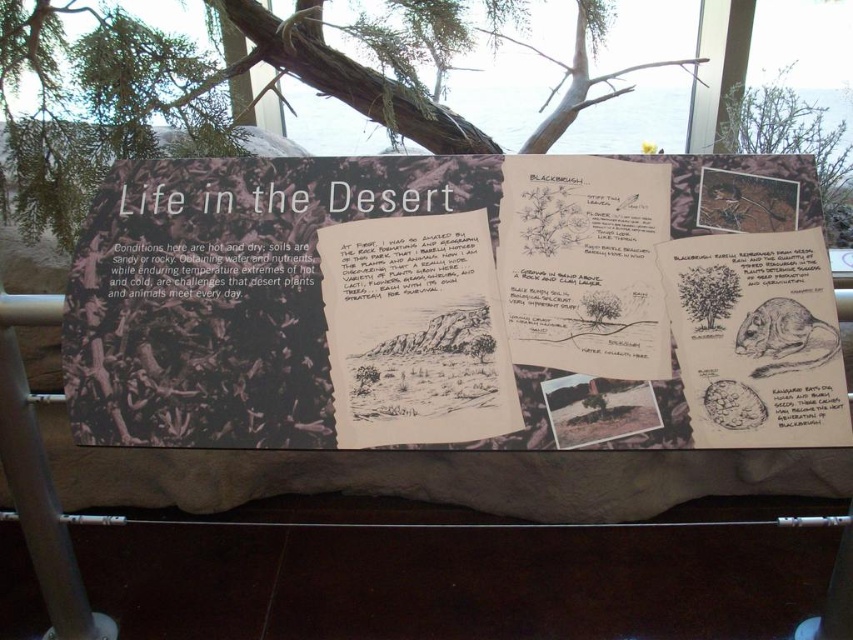
Can you confirm if brown paper sketch at center right is positioned below black paper at lower right?

No, brown paper sketch at center right is not below black paper at lower right.

Between point (692, 381) and point (833, 387), which one is positioned in front?

Positioned in front is point (833, 387).

Does point (809, 435) lie behind point (827, 390)?

No, (809, 435) is closer to viewer.

Identify the location of brown paper sketch at center right. (756, 339).

Does black ink drawing of plant at center appear on the left side of brown paper sketch at center right?

Yes, black ink drawing of plant at center is to the left of brown paper sketch at center right.

Who is more distant from viewer, (x=613, y=346) or (x=737, y=260)?

The point (x=737, y=260) is more distant.

Which is in front, point (592, 314) or point (721, 400)?

Point (721, 400) is more forward.

Where is `black ink drawing of plant at center`? The height and width of the screenshot is (640, 853). black ink drawing of plant at center is located at coordinates (584, 264).

Which of these two, brown paper sketch at center right or black paper text at center, stands taller?

Standing taller between the two is brown paper sketch at center right.

Is brown paper sketch at center right positioned at the back of black paper text at center?

No.

Consider the image. Who is more forward, (708, 262) or (265, 285)?

Positioned in front is point (708, 262).

The image size is (853, 640). Identify the location of brown paper sketch at center right. (756, 339).